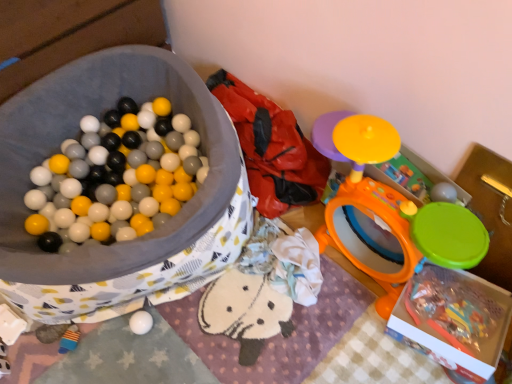
Image resolution: width=512 pixels, height=384 pixels. Identify the location of vacant space situated on the left part of white matte ball at lower center, which is the second toy in bottom-to-top order. (93, 343).